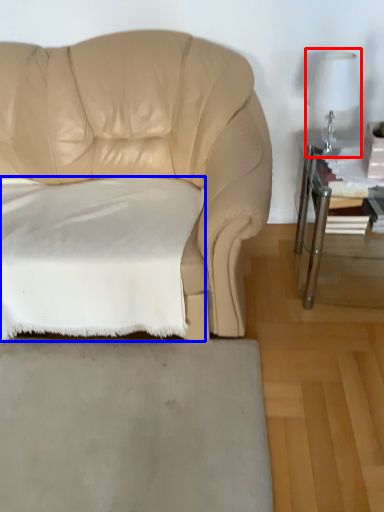
Question: Which object appears farthest to the camera in this image, table lamp (highlighted by a red box) or pillow (highlighted by a blue box)?

Choices:
 (A) table lamp
 (B) pillow

Answer: (A)